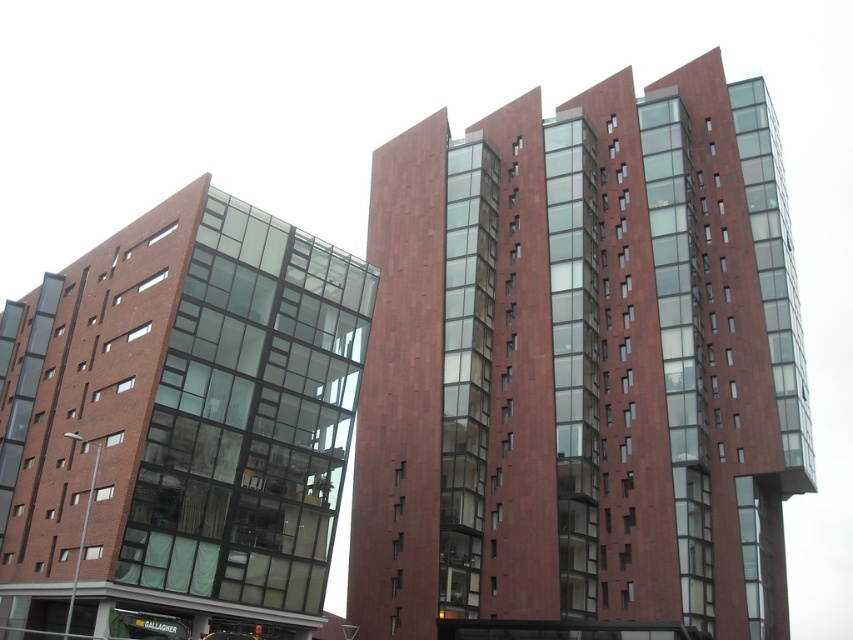
Which is above, red brick building at center or matte brick building at left?

Positioned higher is red brick building at center.

Which is in front, point (688, 531) or point (169, 609)?

Point (169, 609)

Identify the location of red brick building at center. (582, 365).